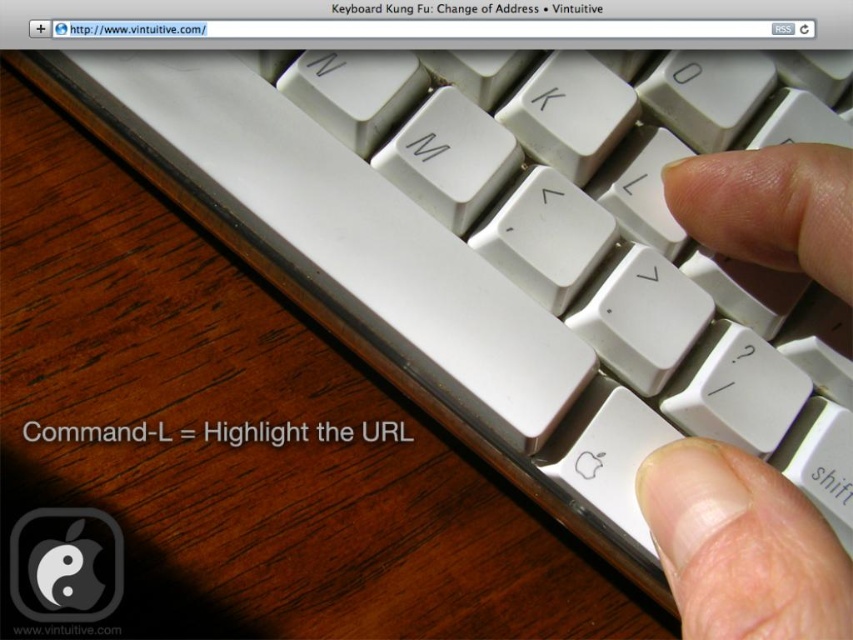
Question: From the image, what is the correct spatial relationship of white plastic finger at center in relation to white matte finger at lower right?

Choices:
 (A) below
 (B) above

Answer: (B)

Question: Observing the image, what is the correct spatial positioning of white plastic finger at center in reference to white matte finger at lower right?

Choices:
 (A) below
 (B) above

Answer: (B)

Question: Which point is farther to the camera?

Choices:
 (A) white matte finger at lower right
 (B) white plastic finger at center

Answer: (A)

Question: Which point is farther to the camera?

Choices:
 (A) (721, 621)
 (B) (802, 257)

Answer: (B)

Question: Does white plastic finger at center have a larger size compared to white matte finger at lower right?

Choices:
 (A) no
 (B) yes

Answer: (B)

Question: Which point is farther from the camera taking this photo?

Choices:
 (A) (784, 556)
 (B) (722, 593)

Answer: (B)